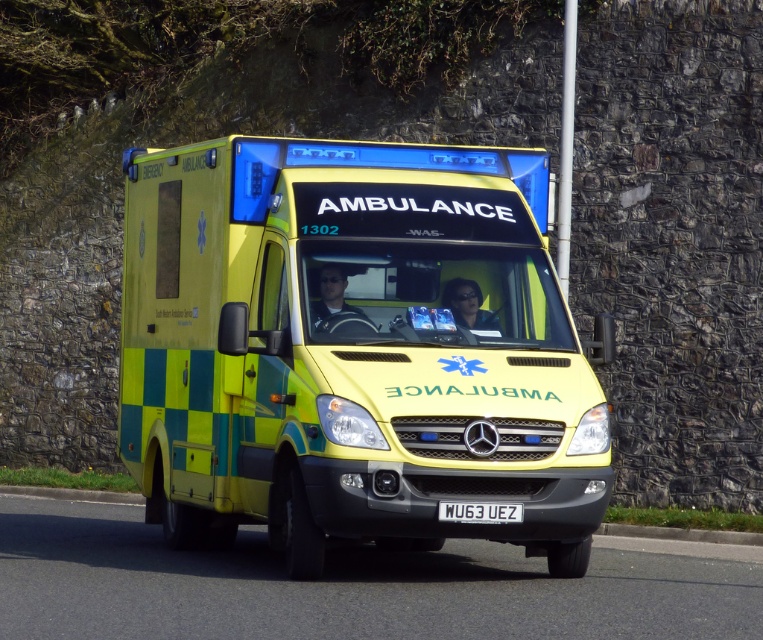
You are a pedestrian standing on the sidewalk and see the ambulance with its lights flashing. You notice a matte black helmet at center and a white plastic license plate at center. Which object is closer to the left side of the ambulance?

The matte black helmet at center is to the left of the white plastic license plate at center, so it is closer to the left side of the ambulance.